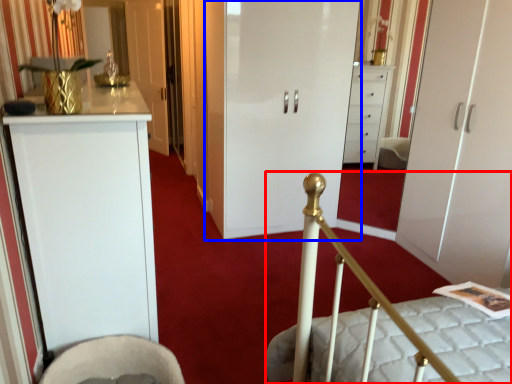
Question: Which of the following is the farthest to the observer, bed (highlighted by a red box) or door (highlighted by a blue box)?

Choices:
 (A) bed
 (B) door

Answer: (B)